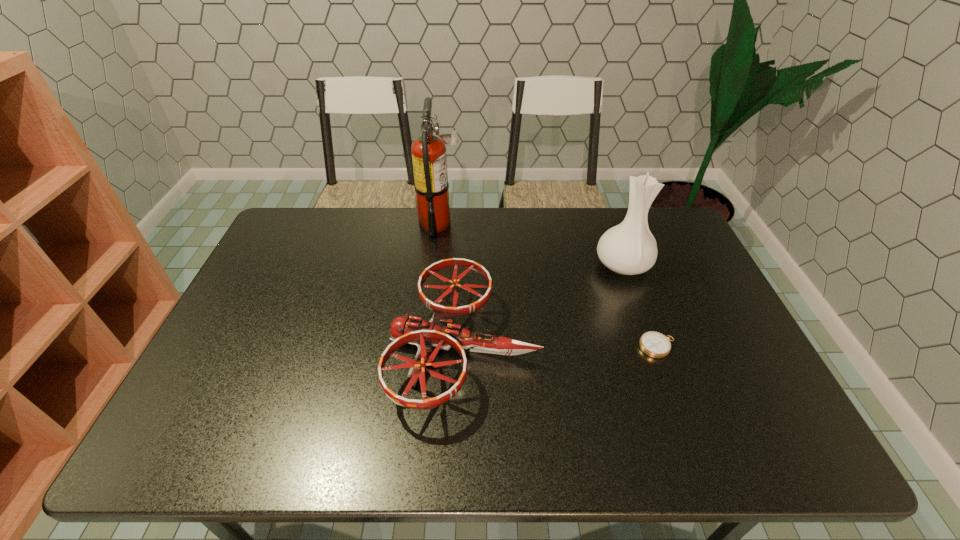
Locate an element on the screen. The width and height of the screenshot is (960, 540). free space that is in between the shortest object and the fire extinguisher is located at coordinates click(549, 285).

The height and width of the screenshot is (540, 960). Find the location of `free spot between the shortest object and the drone`. free spot between the shortest object and the drone is located at coordinates pyautogui.click(x=562, y=347).

Locate an element on the screen. This screenshot has width=960, height=540. free point between the vase and the second shortest object is located at coordinates (544, 306).

You are a GUI agent. You are given a task and a screenshot of the screen. Output one action in this format:
    pyautogui.click(x=<x>, y=<y>)
    Task: Click on the free space between the fire extinguisher and the third nearest object
    This screenshot has height=540, width=960.
    Given the screenshot: What is the action you would take?
    pyautogui.click(x=531, y=244)

The width and height of the screenshot is (960, 540). Identify the location of unoccupied area between the tallest object and the second farthest object. (531, 244).

The height and width of the screenshot is (540, 960). I want to click on vacant space that's between the tallest object and the compass, so click(549, 285).

You are a GUI agent. You are given a task and a screenshot of the screen. Output one action in this format:
    pyautogui.click(x=<x>, y=<y>)
    Task: Click on the empty space between the drone and the vase
    
    Given the screenshot: What is the action you would take?
    pyautogui.click(x=544, y=306)

Image resolution: width=960 pixels, height=540 pixels. Identify the location of vacant area that lies between the vase and the second shortest object. (544, 306).

Locate an element on the screen. The width and height of the screenshot is (960, 540). the third closest object to the drone is located at coordinates (654, 344).

The image size is (960, 540). I want to click on object that stands as the closest to the third nearest object, so click(654, 344).